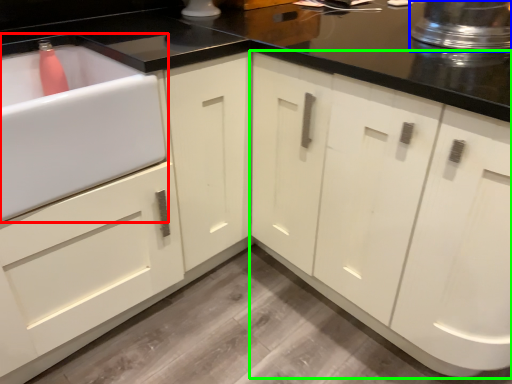
Question: Which object is positioned closest to sink (highlighted by a red box)? Select from appliance (highlighted by a blue box) and cabinetry (highlighted by a green box).

Choices:
 (A) appliance
 (B) cabinetry

Answer: (B)